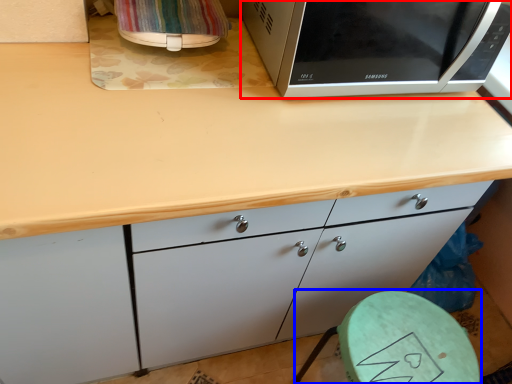
Question: Which of the following is the farthest to the observer, microwave oven (highlighted by a red box) or round table (highlighted by a blue box)?

Choices:
 (A) microwave oven
 (B) round table

Answer: (B)